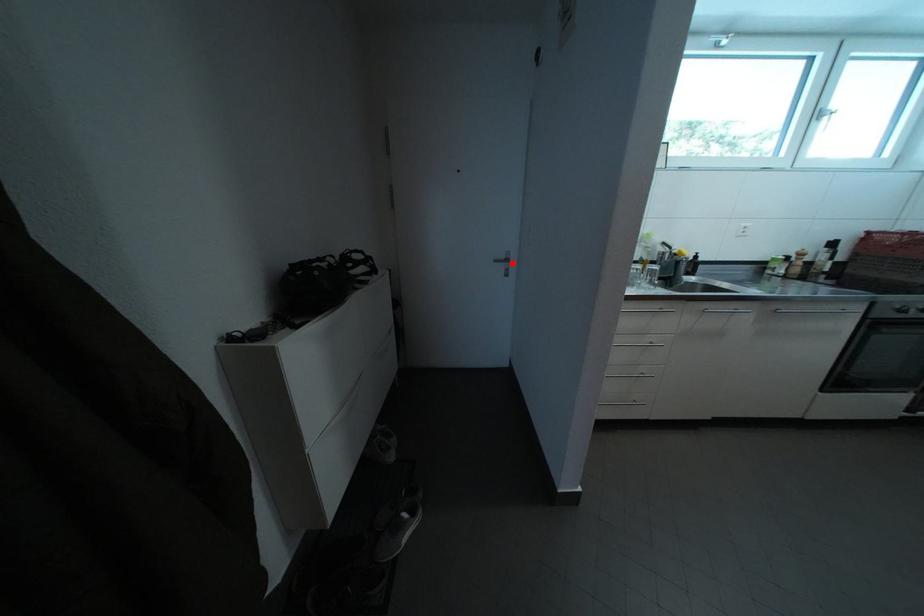
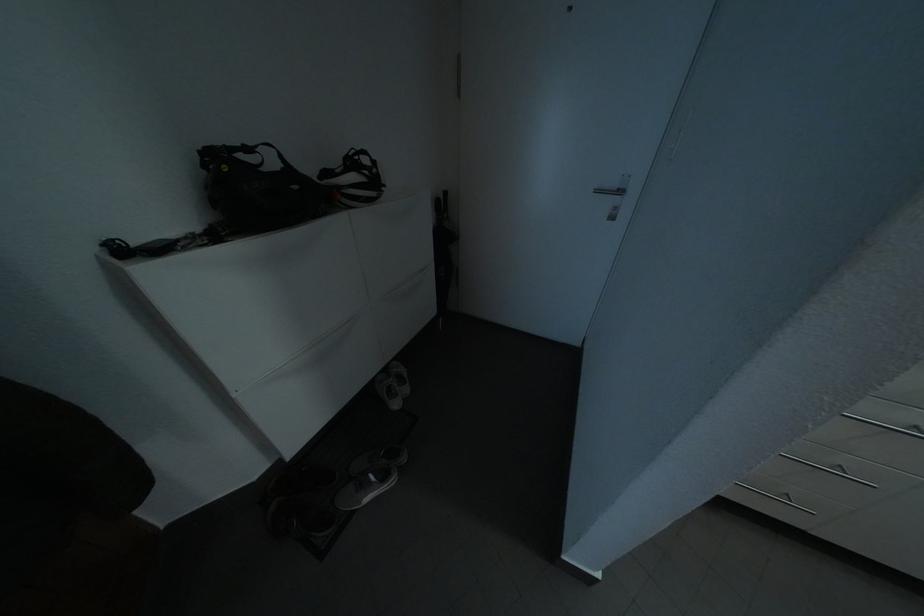
Find the pixel in the second image that matches the highlighted location in the first image.

(624, 191)